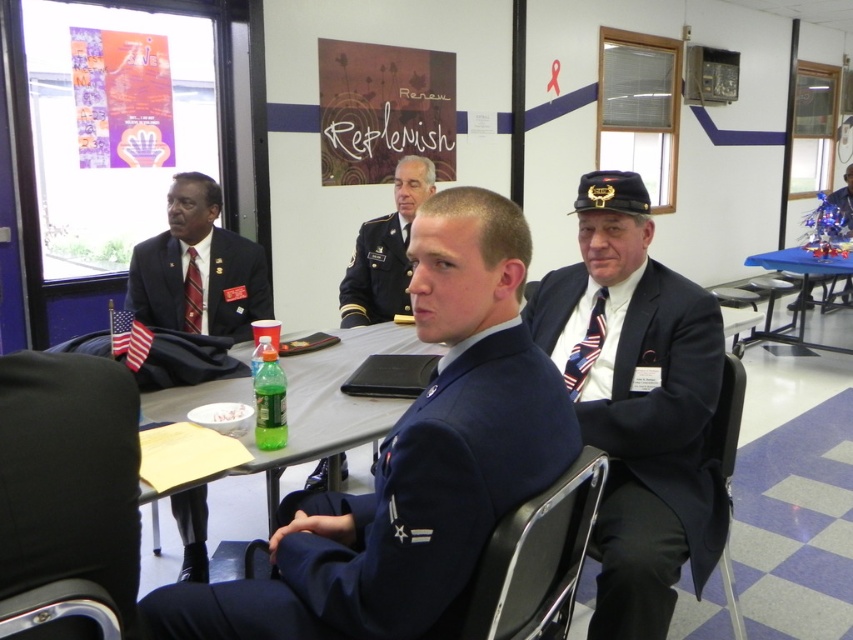
You are a photographer setting up for a formal event. You need to ensure that the dark blue fabric business suit at center and the blue silk tie at center are both visible in the frame. Based on their positions, which one should you focus on first to ensure proper alignment?

The blue silk tie at center is located above the dark blue fabric business suit at center, so you should focus on the blue silk tie at center first to ensure both are in frame.

You are organizing a charity event and need to decide which item to place in a small donation box. The blue uniform at center and the striped silk tie at left are both available. Based on their sizes, which item can fit into the box?

The striped silk tie at left can fit into the box because it is smaller than the blue uniform at center.

Based on the photo, you are a photographer trying to capture a portrait of the man wearing the dark blue fabric business suit at center and the blue silk tie at center. Since you want to ensure both items are clearly visible, which one should you focus on first to avoid blurriness?

The dark blue fabric business suit at center is much taller than the blue silk tie at center, so you should focus on the dark blue fabric business suit at center first to ensure clarity before adjusting for the smaller detail of the blue silk tie at center.